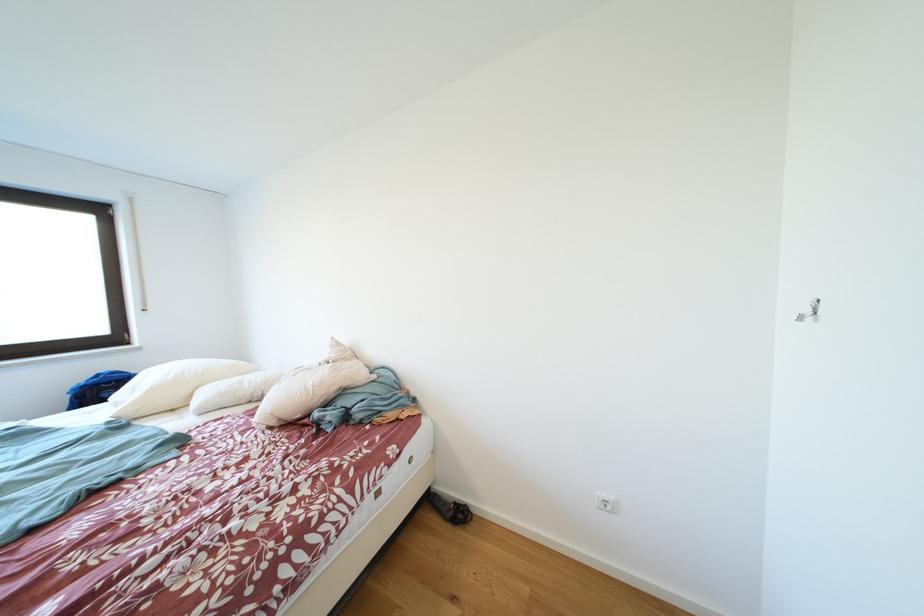
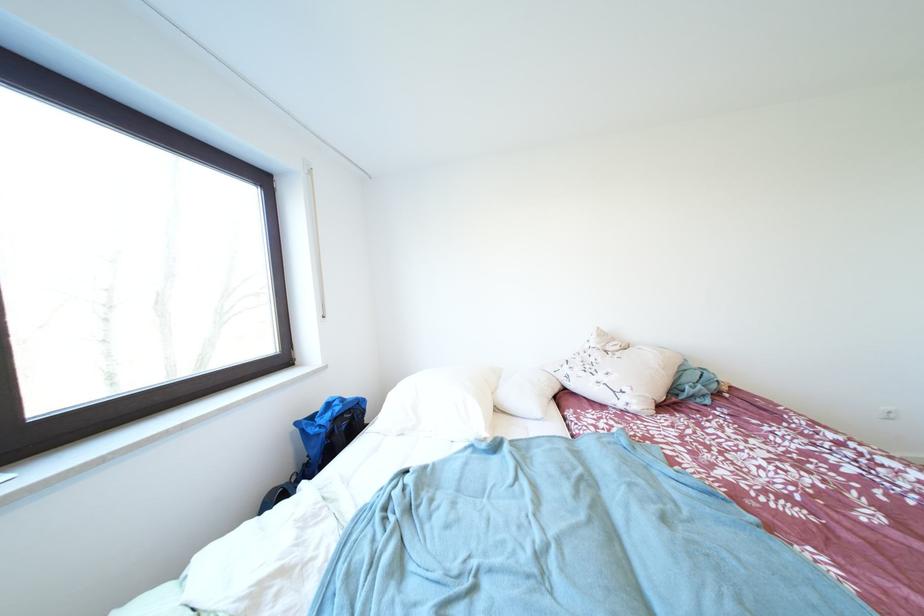
The point at (341,342) is marked in the first image. Where is the corresponding point in the second image?

(606, 333)